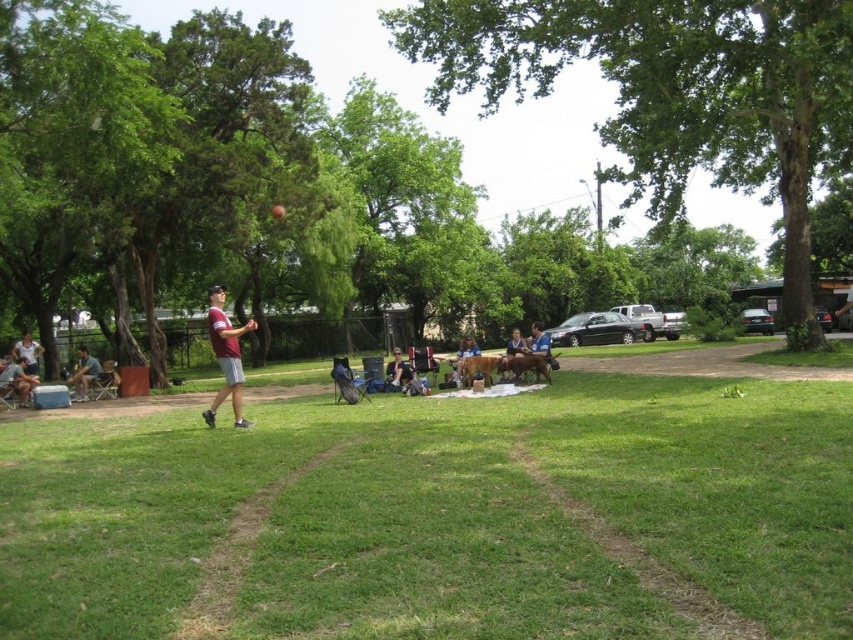
Question: Observing the image, what is the correct spatial positioning of matte gray shorts at left in reference to blue fabric chair at center?

Choices:
 (A) above
 (B) below

Answer: (B)

Question: Is the position of matte gray shorts at lower left less distant than that of blue denim jeans at center?

Choices:
 (A) no
 (B) yes

Answer: (B)

Question: Which is nearer to the maroon jersey at center?

Choices:
 (A) matte gray shorts at lower left
 (B) matte gray shorts at center

Answer: (A)

Question: Can you confirm if maroon jersey at center is wider than blue denim jeans at center?

Choices:
 (A) yes
 (B) no

Answer: (A)

Question: Which point is farther from the camera taking this photo?

Choices:
 (A) (91, 364)
 (B) (457, 364)
 (C) (524, 348)
 (D) (12, 388)

Answer: (A)

Question: Which of these objects is positioned farthest from the matte gray shorts at center?

Choices:
 (A) maroon jersey at center
 (B) matte gray shorts at lower left
 (C) blue fabric chair at center

Answer: (B)